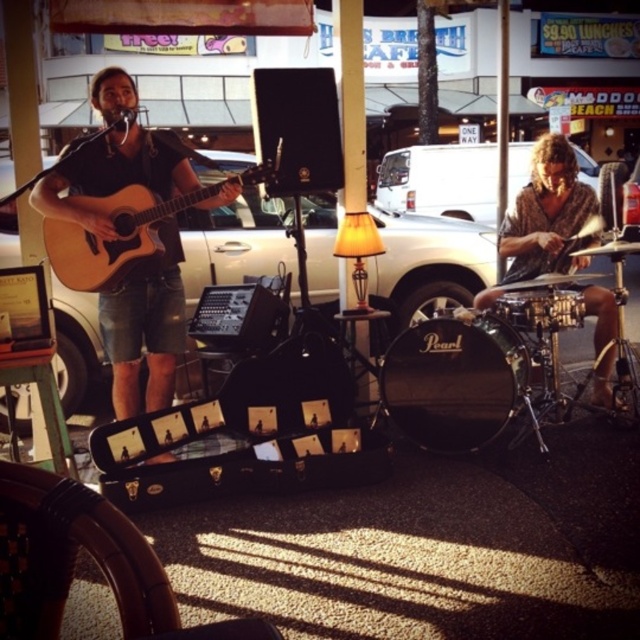
You are a street performer who needs to pass a 2.5 meter long banner between the textured brown shirt at right and the natural wood acoustic guitar at left. Can you fit the banner between them without bending it?

The distance between the textured brown shirt at right and the natural wood acoustic guitar at left is 2.22 meters, which is shorter than the 2.5 meter banner. Therefore, the banner cannot be placed straight between them without bending.

You are a street performer who needs to adjust the distance between your matte brown guitar at left and gold metallic drum at right to exactly 1.5 meters for a performance setup. Based on the current arrangement shown in the image, is the current distance sufficient? Please explain.

The current distance between the matte brown guitar at left and the gold metallic drum at right is 2.06 meters, which is greater than the required 1.5 meters. Therefore, the performers need to move the instruments closer to achieve the desired distance.